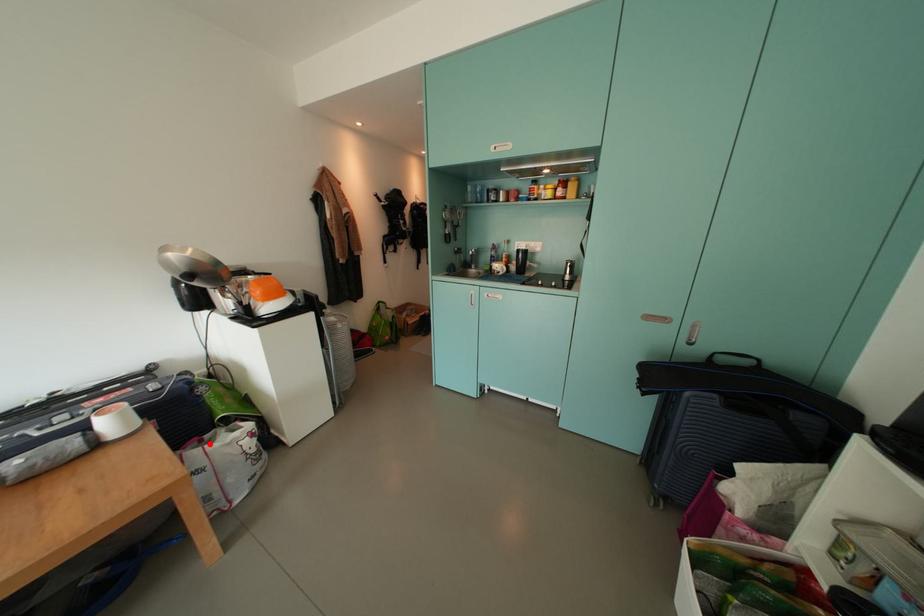
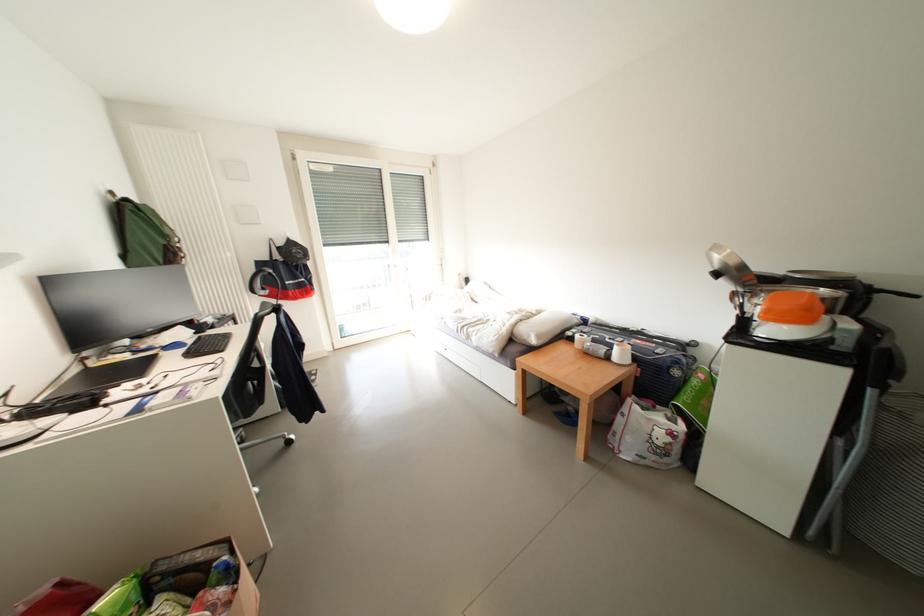
Find the pixel in the second image that matches the highlighted location in the first image.

(662, 410)